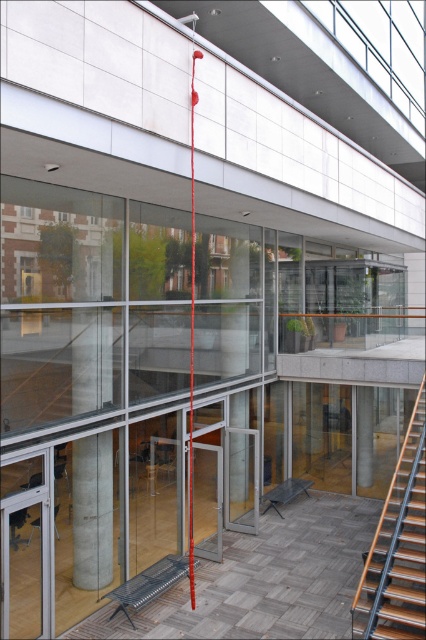
Who is more distant from viewer, [365,561] or [167,556]?

The point [167,556] is more distant.

In order to click on wooden at right in this screenshot , I will do pyautogui.click(x=397, y=548).